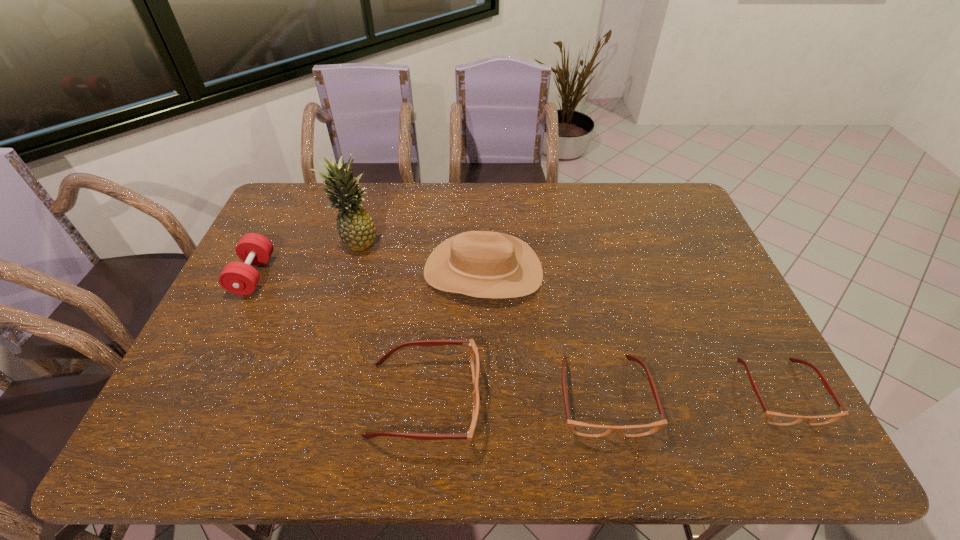
The spectacless are evenly distributed in the image. To maintain this, where would you place another spectacles on the left? Please point to a free space. Please provide its 2D coordinates. Your answer should be formatted as a tuple, i.e. [(x, y)], where the tuple contains the x and y coordinates of a point satisfying the conditions above.

[(243, 403)]